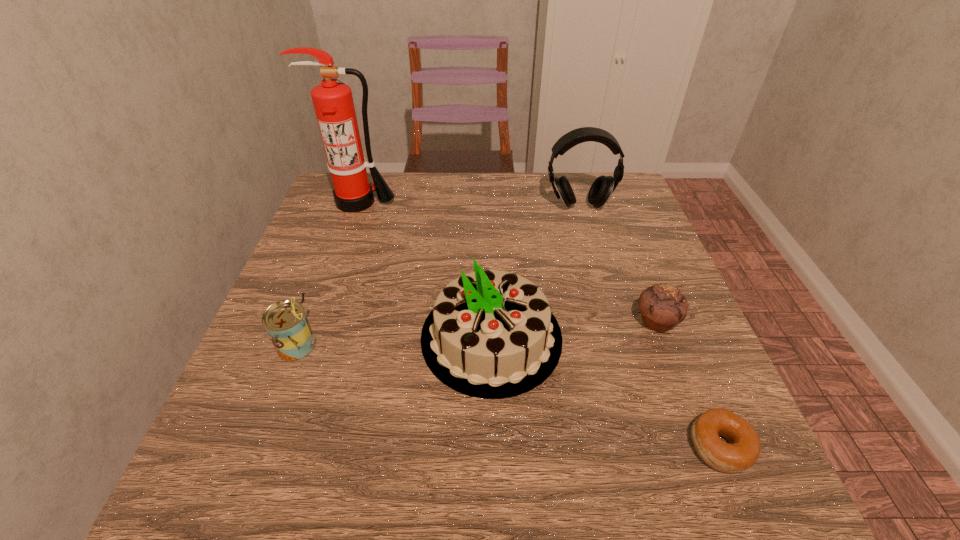
Where is `muffin that is at the right edge`? muffin that is at the right edge is located at coordinates (662, 306).

The height and width of the screenshot is (540, 960). Identify the location of bagel at the right edge. (742, 451).

Where is `object at the far left corner`? object at the far left corner is located at coordinates (333, 102).

Where is `object that is at the far right corner`? object that is at the far right corner is located at coordinates (602, 188).

Find the location of a particular element. This screenshot has height=540, width=960. object that is at the near right corner is located at coordinates (742, 451).

Identify the location of free point at the far edge. (427, 191).

Locate an element on the screen. This screenshot has width=960, height=540. free space at the near edge of the desktop is located at coordinates (550, 474).

The image size is (960, 540). In the image, there is a desktop. In order to click on blank space at the left edge in this screenshot , I will do `click(298, 261)`.

Where is `vacant space at the right edge of the desktop`? The image size is (960, 540). vacant space at the right edge of the desktop is located at coordinates (640, 280).

What are the coordinates of `vacant space at the near left corner of the desktop` in the screenshot? It's located at (277, 458).